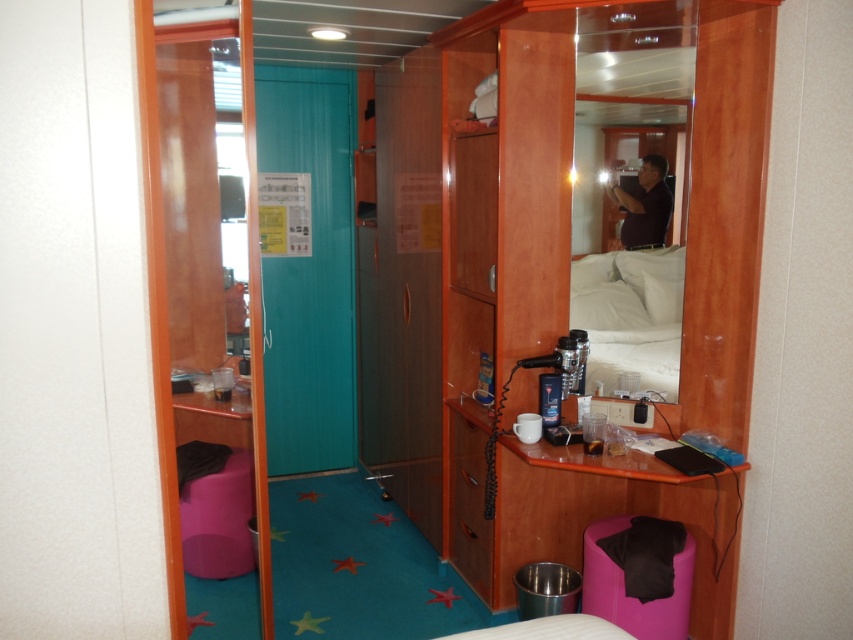
Question: Is wooden cabinet at center further to the viewer compared to purple fabric stool at lower right?

Choices:
 (A) no
 (B) yes

Answer: (A)

Question: Is purple fabric stool at lower right thinner than black matte man at upper center?

Choices:
 (A) yes
 (B) no

Answer: (B)

Question: Which object appears farthest from the camera in this image?

Choices:
 (A) wooden cabinet at center
 (B) black matte man at upper center
 (C) white soft bed at center

Answer: (B)

Question: Which is farther from the black matte man at upper center?

Choices:
 (A) wooden cabinet at center
 (B) purple fabric stool at lower right

Answer: (B)

Question: Is wooden cabinet at center to the right of purple fabric stool at lower right from the viewer's perspective?

Choices:
 (A) no
 (B) yes

Answer: (A)

Question: Which object appears farthest from the camera in this image?

Choices:
 (A) wooden cabinet at center
 (B) black matte man at upper center

Answer: (B)